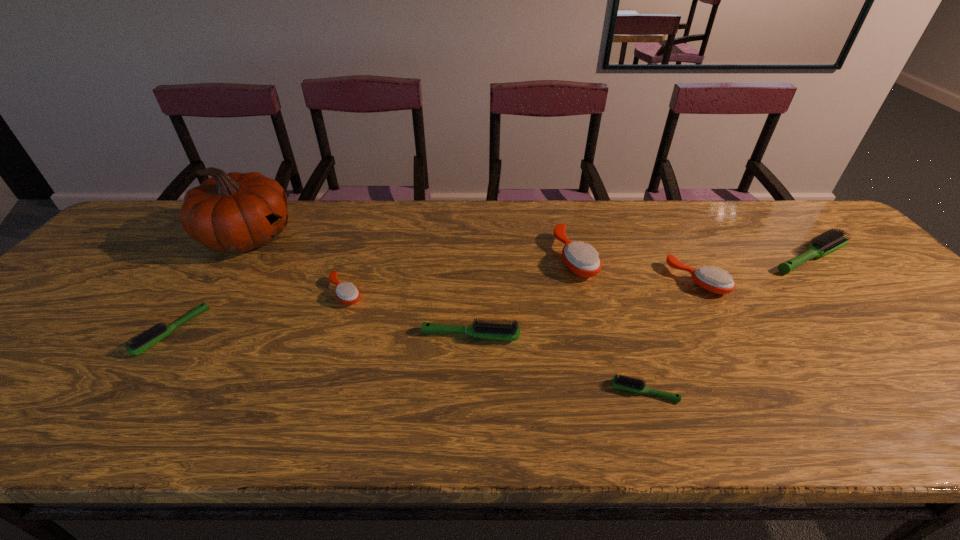
Image resolution: width=960 pixels, height=540 pixels. I want to click on light hairbrush that stands as the second closest to the third hairbrush from left to right, so click(145, 340).

This screenshot has width=960, height=540. I want to click on vacant space that satisfies the following two spatial constraints: 1. on the face of the orange pumpkin; 2. on the back side of the third smallest light hairbrush, so click(x=181, y=336).

You are a GUI agent. You are given a task and a screenshot of the screen. Output one action in this format:
    pyautogui.click(x=<x>, y=<y>)
    Task: Click on the free space that satisfies the following two spatial constraints: 1. on the face of the pumpkin; 2. on the right side of the second light hairbrush from right to left
    This screenshot has height=540, width=960.
    Given the screenshot: What is the action you would take?
    pyautogui.click(x=144, y=392)

Where is `blank space that satisfies the following two spatial constraints: 1. on the face of the orange pumpkin; 2. on the back side of the farthest light hairbrush`? Image resolution: width=960 pixels, height=540 pixels. blank space that satisfies the following two spatial constraints: 1. on the face of the orange pumpkin; 2. on the back side of the farthest light hairbrush is located at coordinates (234, 257).

The image size is (960, 540). Identify the location of free space that satisfies the following two spatial constraints: 1. on the back side of the leftmost hairbrush; 2. on the right side of the tallest hairbrush. (224, 257).

The image size is (960, 540). In order to click on free location that satisfies the following two spatial constraints: 1. on the face of the pumpkin; 2. on the left side of the rightmost light hairbrush in this screenshot , I will do `click(234, 257)`.